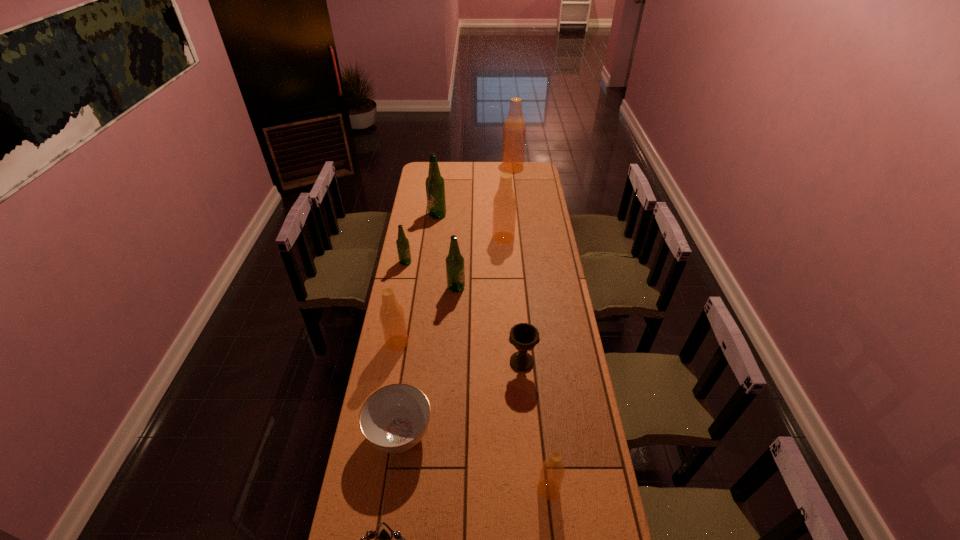
Find the location of a particular element. This screenshot has height=540, width=960. the closest beer bottle to the second biggest green beer bottle is located at coordinates (403, 247).

Identify the location of beer bottle that is the sixth closest to the third nearest object. (435, 186).

The image size is (960, 540). I want to click on the second closest tan beer bottle to the chinaware, so (x=552, y=472).

You are a GUI agent. You are given a task and a screenshot of the screen. Output one action in this format:
    pyautogui.click(x=<x>, y=<y>)
    Task: Click on the tan beer bottle that is the closest to the third shortest object
    
    Given the screenshot: What is the action you would take?
    pyautogui.click(x=552, y=472)

This screenshot has height=540, width=960. I want to click on green beer bottle that is the closest to the nearest object, so click(x=455, y=271).

I want to click on green beer bottle that is the third closest to the second nearest beer bottle, so click(435, 186).

You are a GUI agent. You are given a task and a screenshot of the screen. Output one action in this format:
    pyautogui.click(x=<x>, y=<y>)
    Task: Click on the free space in the image that satisfies the following two spatial constraints: 1. on the label of the fourth farthest object; 2. on the left side of the eighth farthest object
    The height and width of the screenshot is (540, 960).
    Given the screenshot: What is the action you would take?
    pyautogui.click(x=373, y=434)

Image resolution: width=960 pixels, height=540 pixels. In order to click on vacant space that satisfies the following two spatial constraints: 1. on the label of the nearest tan beer bottle; 2. on the right side of the smallest green beer bottle in this screenshot , I will do `click(363, 490)`.

This screenshot has height=540, width=960. I want to click on vacant region that satisfies the following two spatial constraints: 1. on the label of the fourth farthest object; 2. on the back side of the third nearest object, so click(x=373, y=434).

Locate an element on the screen. vacant space that satisfies the following two spatial constraints: 1. on the label of the rightmost green beer bottle; 2. on the back side of the second nearest object is located at coordinates (444, 490).